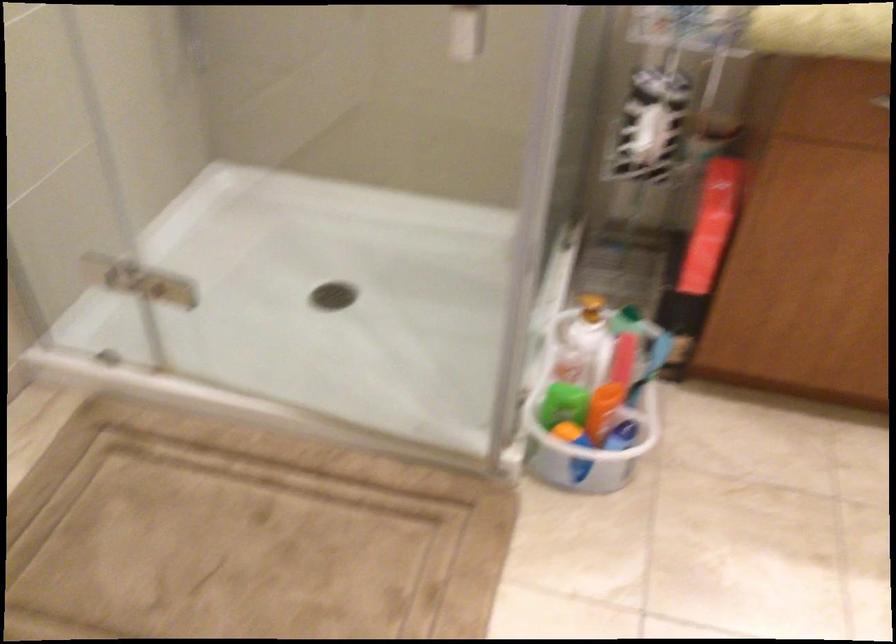
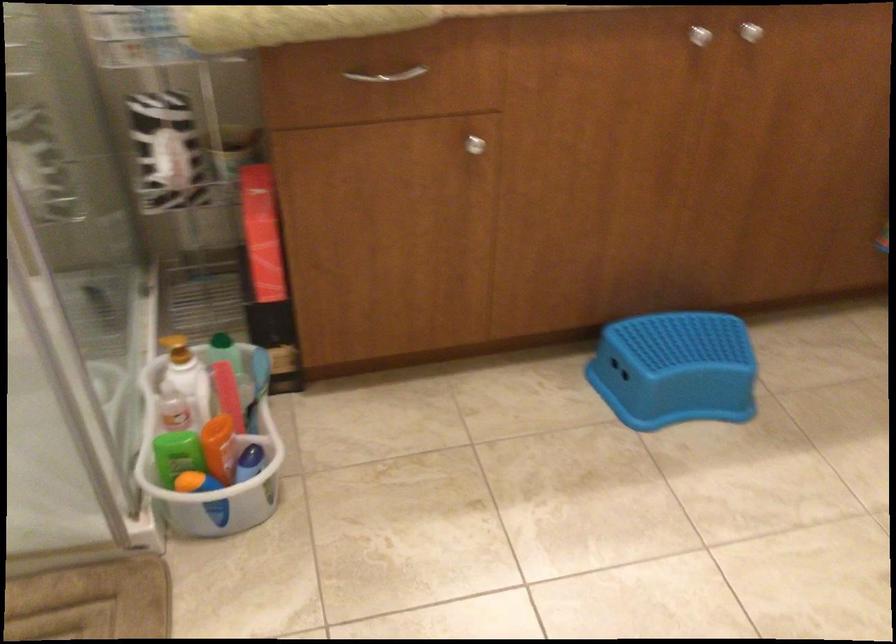
Locate, in the second image, the point that corresponds to (564,398) in the first image.

(177, 453)